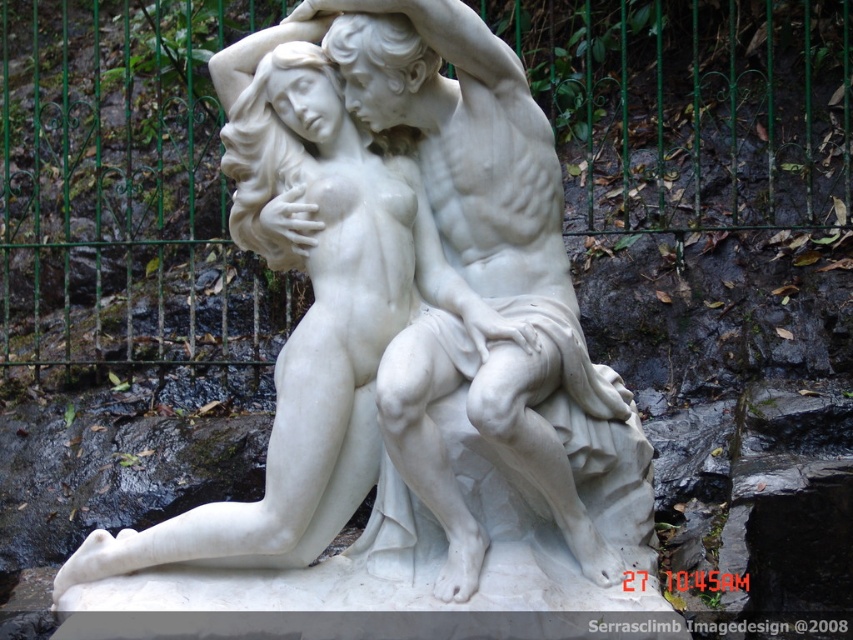
Question: Which object appears farthest from the camera in this image?

Choices:
 (A) white marble statue at center
 (B) green metal fence at upper center

Answer: (B)

Question: Which object appears closest to the camera in this image?

Choices:
 (A) green metal fence at upper center
 (B) white marble statue at center

Answer: (B)

Question: Can you confirm if green metal fence at upper center is positioned to the right of white marble statue at center?

Choices:
 (A) yes
 (B) no

Answer: (B)

Question: Can you confirm if green metal fence at upper center is positioned to the left of white marble statue at center?

Choices:
 (A) yes
 (B) no

Answer: (A)

Question: Among these objects, which one is farthest from the camera?

Choices:
 (A) white marble statue at center
 (B) green metal fence at upper center

Answer: (B)

Question: Is green metal fence at upper center above white marble statue at center?

Choices:
 (A) no
 (B) yes

Answer: (B)